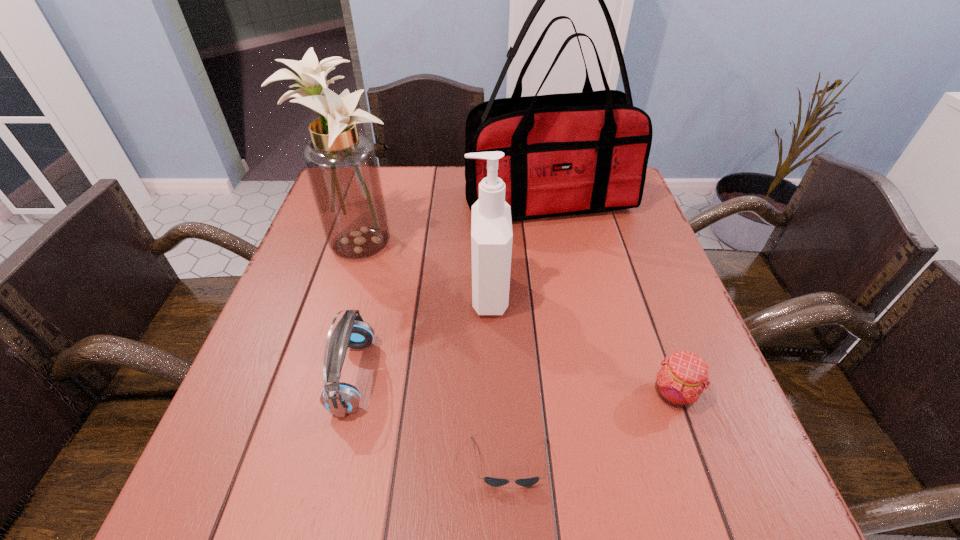
In the image, there is a desktop. Where is `vacant space at the near edge`? vacant space at the near edge is located at coordinates (625, 511).

Identify the location of vacant space at the left edge. (312, 330).

The height and width of the screenshot is (540, 960). Identify the location of vacant space at the right edge of the desktop. (664, 289).

Find the location of `free space at the near right corner of the desktop`. free space at the near right corner of the desktop is located at coordinates pyautogui.click(x=761, y=515).

The image size is (960, 540). Find the location of `empty space that is in between the tallest object and the nearest object`. empty space that is in between the tallest object and the nearest object is located at coordinates (530, 331).

This screenshot has width=960, height=540. What are the coordinates of `vacant area that lies between the fourth shortest object and the duffel bag` in the screenshot? It's located at (518, 247).

Locate an element on the screen. This screenshot has width=960, height=540. vacant point located between the sunglasses and the jam is located at coordinates (592, 428).

What are the coordinates of `free area in between the duffel bag and the cleansing agent` in the screenshot? It's located at coord(518,247).

The width and height of the screenshot is (960, 540). What are the coordinates of `free space between the headset and the fourth shortest object` in the screenshot? It's located at (420, 335).

I want to click on empty space between the second tallest object and the nearest object, so click(434, 354).